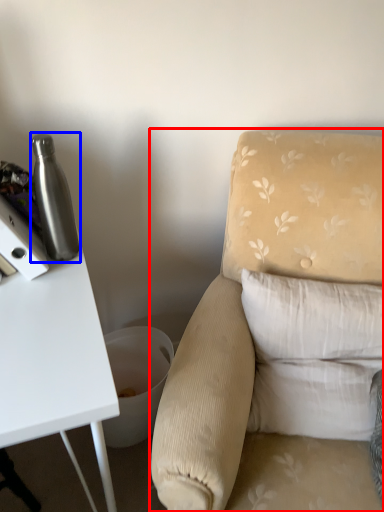
Question: Which of the following is the closest to the observer, chair (highlighted by a red box) or bottle (highlighted by a blue box)?

Choices:
 (A) chair
 (B) bottle

Answer: (A)